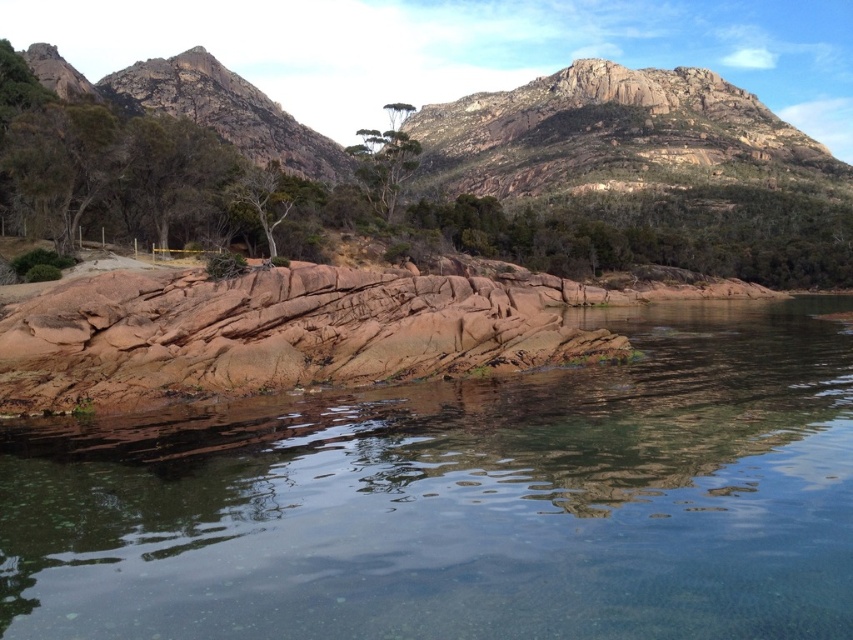
Which of these two, rustic granite mountain at upper center or rustic stone rock at center, stands taller?

Standing taller between the two is rustic granite mountain at upper center.

Is rustic granite mountain at upper center positioned behind rustic stone rock at center?

Yes, rustic granite mountain at upper center is further from the viewer.

Who is more distant from viewer, [236,221] or [437,330]?

The point [236,221] is behind.

You are a GUI agent. You are given a task and a screenshot of the screen. Output one action in this format:
    pyautogui.click(x=<x>, y=<y>)
    Task: Click on the rustic granite mountain at upper center
    
    Given the screenshot: What is the action you would take?
    pyautogui.click(x=447, y=170)

What do you see at coordinates (447, 170) in the screenshot? I see `rustic granite mountain at upper center` at bounding box center [447, 170].

Is point (265, 120) positioned in front of point (267, 211)?

No, (265, 120) is behind (267, 211).

Identify the location of rustic granite mountain at upper center. This screenshot has width=853, height=640. (447, 170).

Is the position of rustic granite mountain at upper center more distant than that of green textured tree at center?

No, rustic granite mountain at upper center is closer to the viewer.

I want to click on rustic granite mountain at upper center, so click(x=447, y=170).